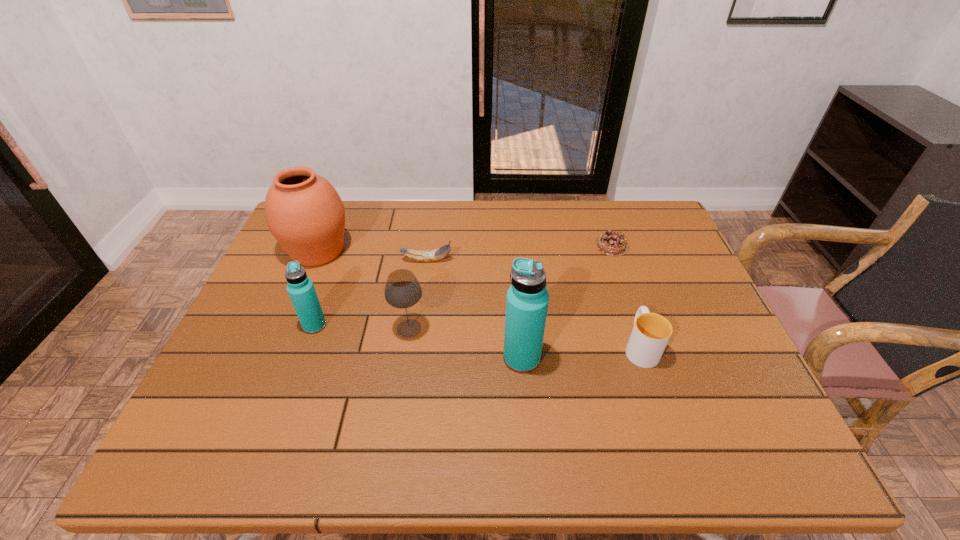
Image resolution: width=960 pixels, height=540 pixels. I want to click on the shorter water bottle, so click(x=301, y=290).

Locate an element on the screen. Image resolution: width=960 pixels, height=540 pixels. the left water bottle is located at coordinates (301, 290).

This screenshot has height=540, width=960. I want to click on the nearer water bottle, so click(x=527, y=300).

You are a GUI agent. You are given a task and a screenshot of the screen. Output one action in this format:
    pyautogui.click(x=<x>, y=<y>)
    Task: Click on the taller water bottle
    The height and width of the screenshot is (540, 960).
    Given the screenshot: What is the action you would take?
    pyautogui.click(x=527, y=300)

Locate an element on the screen. banana is located at coordinates (431, 255).

The height and width of the screenshot is (540, 960). In order to click on the shortest object in this screenshot , I will do `click(610, 243)`.

Find the location of `the second tallest object`. the second tallest object is located at coordinates (303, 211).

Locate an element on the screen. the fifth tallest object is located at coordinates (651, 332).

Identify the location of wineglass. This screenshot has width=960, height=540. (402, 290).

This screenshot has height=540, width=960. Find the location of `free location located 0.320m on the back of the shorter water bottle`. free location located 0.320m on the back of the shorter water bottle is located at coordinates (345, 241).